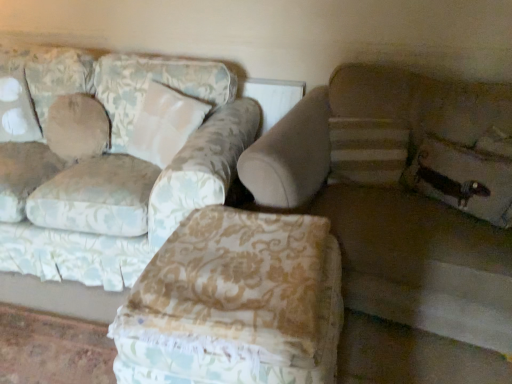
Identify the location of floral fabric pillow at lower right, which ranks as the first pillow in right-to-left order. The width and height of the screenshot is (512, 384). (464, 179).

What do you see at coordinates (234, 303) in the screenshot? The image size is (512, 384). I see `floral fabric ottoman at center` at bounding box center [234, 303].

How much space does beige fabric pillow at upper left, placed as the 2th pillow when sorted from front to back, occupy horizontally?

beige fabric pillow at upper left, placed as the 2th pillow when sorted from front to back, is 22.76 centimeters wide.

You are a GUI agent. You are given a task and a screenshot of the screen. Output one action in this format:
    pyautogui.click(x=<x>, y=<y>)
    Task: Click on the beige fabric couch at right, the second studio couch from the left
    This screenshot has width=512, height=384.
    Given the screenshot: What is the action you would take?
    pyautogui.click(x=402, y=194)

Can you see beige fabric couch at right, the first studio couch when ordered from right to left, touching floral fabric pillow at lower right, which ranks as the first pillow in right-to-left order?

No, beige fabric couch at right, the first studio couch when ordered from right to left, is not beside floral fabric pillow at lower right, which ranks as the first pillow in right-to-left order.

Would you say beige fabric couch at right, the first studio couch when ordered from right to left, is to the left or to the right of floral fabric pillow at lower right, the first pillow viewed from the front, in the picture?

In the image, beige fabric couch at right, the first studio couch when ordered from right to left, appears on the left side of floral fabric pillow at lower right, the first pillow viewed from the front.

From a real-world perspective, is beige fabric couch at right, the first studio couch when ordered from right to left, beneath floral fabric pillow at lower right, the first pillow viewed from the front?

Yes, from a real-world perspective, beige fabric couch at right, the first studio couch when ordered from right to left, is beneath floral fabric pillow at lower right, the first pillow viewed from the front.

How many degrees apart are the facing directions of beige fabric couch at right, the first studio couch when ordered from right to left, and floral fabric pillow at lower right, the 2th pillow viewed from the back?

The angle between the facing direction of beige fabric couch at right, the first studio couch when ordered from right to left, and the facing direction of floral fabric pillow at lower right, the 2th pillow viewed from the back, is 28 degrees.

Does point (202, 80) come closer to viewer compared to point (398, 144)?

No, it is behind (398, 144).

You are a GUI agent. You are given a task and a screenshot of the screen. Output one action in this format:
    pyautogui.click(x=<x>, y=<y>)
    Task: Click on the studio couch behind the beige fabric couch at right, the second studio couch from the left
    
    Given the screenshot: What is the action you would take?
    pyautogui.click(x=125, y=165)

Does floral fabric couch at left, the 2th studio couch in the right-to-left sequence, turn towards beige fabric couch at right, the second studio couch from the left?

No, floral fabric couch at left, the 2th studio couch in the right-to-left sequence, is not turned towards beige fabric couch at right, the second studio couch from the left.

Would you say floral fabric couch at left, the 2th studio couch in the right-to-left sequence, contains beige fabric couch at right, the first studio couch when ordered from right to left?

That's incorrect, beige fabric couch at right, the first studio couch when ordered from right to left, is not inside floral fabric couch at left, the 2th studio couch in the right-to-left sequence.

Is floral fabric ottoman at center wider than floral fabric pillow at lower right, the 2th pillow viewed from the back?

Yes, floral fabric ottoman at center is wider than floral fabric pillow at lower right, the 2th pillow viewed from the back.

Is floral fabric ottoman at center directly adjacent to floral fabric pillow at lower right, which ranks as the first pillow in right-to-left order?

No, floral fabric ottoman at center is not beside floral fabric pillow at lower right, which ranks as the first pillow in right-to-left order.

Is floral fabric ottoman at center located outside floral fabric pillow at lower right, the 2th pillow viewed from the back?

Indeed, floral fabric ottoman at center is completely outside floral fabric pillow at lower right, the 2th pillow viewed from the back.

Is beige fabric pillow at upper left, placed as the 2th pillow when sorted from front to back, to the left of floral fabric pillow at lower right, the 2th pillow viewed from the back, from the viewer's perspective?

Correct, you'll find beige fabric pillow at upper left, placed as the 2th pillow when sorted from front to back, to the left of floral fabric pillow at lower right, the 2th pillow viewed from the back.

Which object is closer to the camera, beige fabric pillow at upper left, the first pillow positioned from the back, or floral fabric pillow at lower right, which is counted as the 2th pillow, starting from the left?

floral fabric pillow at lower right, which is counted as the 2th pillow, starting from the left.

From a real-world perspective, is beige fabric pillow at upper left, arranged as the 2th pillow when viewed from the right, on top of floral fabric pillow at lower right, the 2th pillow viewed from the back?

Correct, in the physical world, beige fabric pillow at upper left, arranged as the 2th pillow when viewed from the right, is higher than floral fabric pillow at lower right, the 2th pillow viewed from the back.

In the scene shown: Is beige fabric pillow at upper left, arranged as the 2th pillow when viewed from the right, not inside floral fabric pillow at lower right, which ranks as the first pillow in right-to-left order?

Absolutely, beige fabric pillow at upper left, arranged as the 2th pillow when viewed from the right, is external to floral fabric pillow at lower right, which ranks as the first pillow in right-to-left order.

Which object is positioned more to the right, floral fabric couch at left, the 2th studio couch in the right-to-left sequence, or beige fabric pillow at upper left, the first pillow positioned from the back?

Positioned to the right is floral fabric couch at left, the 2th studio couch in the right-to-left sequence.

Considering the positions of objects floral fabric couch at left, which appears as the 1th studio couch when viewed from the left, and beige fabric pillow at upper left, placed as the 2th pillow when sorted from front to back, in the image provided, who is in front, floral fabric couch at left, which appears as the 1th studio couch when viewed from the left, or beige fabric pillow at upper left, placed as the 2th pillow when sorted from front to back,?

floral fabric couch at left, which appears as the 1th studio couch when viewed from the left, is in front.

Is floral fabric couch at left, the 2th studio couch in the right-to-left sequence, far away from beige fabric pillow at upper left, placed as the 2th pillow when sorted from front to back?

floral fabric couch at left, the 2th studio couch in the right-to-left sequence, is actually quite close to beige fabric pillow at upper left, placed as the 2th pillow when sorted from front to back.

Which is in front, point (256, 125) or point (64, 140)?

The point (64, 140) is closer.

Considering the relative sizes of beige fabric couch at right, the second studio couch from the left, and beige fabric pillow at upper left, the 1th pillow in the left-to-right sequence, in the image provided, is beige fabric couch at right, the second studio couch from the left, wider than beige fabric pillow at upper left, the 1th pillow in the left-to-right sequence,?

Yes, beige fabric couch at right, the second studio couch from the left, is wider than beige fabric pillow at upper left, the 1th pillow in the left-to-right sequence.

Can you tell me how much beige fabric couch at right, the second studio couch from the left, and beige fabric pillow at upper left, the 1th pillow in the left-to-right sequence, differ in facing direction?

16.7 degrees separate the facing orientations of beige fabric couch at right, the second studio couch from the left, and beige fabric pillow at upper left, the 1th pillow in the left-to-right sequence.

Does beige fabric couch at right, the first studio couch when ordered from right to left, lie behind beige fabric pillow at upper left, placed as the 2th pillow when sorted from front to back?

No.

Could you measure the distance between beige fabric couch at right, the second studio couch from the left, and beige fabric pillow at upper left, placed as the 2th pillow when sorted from front to back?

A distance of 4.26 feet exists between beige fabric couch at right, the second studio couch from the left, and beige fabric pillow at upper left, placed as the 2th pillow when sorted from front to back.

Measure the distance from floral fabric ottoman at center to beige fabric couch at right, the first studio couch when ordered from right to left.

floral fabric ottoman at center is 19.43 inches away from beige fabric couch at right, the first studio couch when ordered from right to left.

Is floral fabric ottoman at center next to beige fabric couch at right, the first studio couch when ordered from right to left, and touching it?

No, floral fabric ottoman at center is not in contact with beige fabric couch at right, the first studio couch when ordered from right to left.

Based on the photo, considering the positions of objects floral fabric ottoman at center and beige fabric couch at right, the second studio couch from the left, in the image provided, who is more to the right, floral fabric ottoman at center or beige fabric couch at right, the second studio couch from the left,?

beige fabric couch at right, the second studio couch from the left.

From a real-world perspective, which is physically below, floral fabric ottoman at center or beige fabric couch at right, the second studio couch from the left?

floral fabric ottoman at center, from a real-world perspective.

From the image's perspective, starting from the beige fabric couch at right, the first studio couch when ordered from right to left, which pillow is the 1st one above? Please provide its 2D coordinates.

[(464, 179)]

Where is `studio couch above the floral fabric couch at left, which appears as the 1th studio couch when viewed from the left (from a real-world perspective)`? This screenshot has width=512, height=384. studio couch above the floral fabric couch at left, which appears as the 1th studio couch when viewed from the left (from a real-world perspective) is located at coordinates (402, 194).

Based on their spatial positions, is beige fabric couch at right, the first studio couch when ordered from right to left, or floral fabric pillow at lower right, which ranks as the first pillow in right-to-left order, further from beige fabric pillow at upper left, the first pillow positioned from the back?

The object further to beige fabric pillow at upper left, the first pillow positioned from the back, is floral fabric pillow at lower right, which ranks as the first pillow in right-to-left order.

From the picture: Estimate the real-world distances between objects in this image. Which object is further from beige fabric couch at right, the second studio couch from the left, floral fabric pillow at lower right, the first pillow viewed from the front, or beige fabric pillow at upper left, the first pillow positioned from the back?

Among the two, beige fabric pillow at upper left, the first pillow positioned from the back, is located further to beige fabric couch at right, the second studio couch from the left.

Considering their positions, is floral fabric couch at left, which appears as the 1th studio couch when viewed from the left, positioned closer to beige fabric pillow at upper left, the first pillow positioned from the back, than beige fabric couch at right, the second studio couch from the left?

Based on the image, floral fabric couch at left, which appears as the 1th studio couch when viewed from the left, appears to be nearer to beige fabric pillow at upper left, the first pillow positioned from the back.

When comparing their distances from floral fabric couch at left, which appears as the 1th studio couch when viewed from the left, does floral fabric pillow at lower right, the 2th pillow viewed from the back, or floral fabric ottoman at center seem closer?

Among the two, floral fabric ottoman at center is located nearer to floral fabric couch at left, which appears as the 1th studio couch when viewed from the left.

Which object lies further to the anchor point beige fabric pillow at upper left, placed as the 2th pillow when sorted from front to back, floral fabric ottoman at center or floral fabric pillow at lower right, the 2th pillow viewed from the back?

floral fabric pillow at lower right, the 2th pillow viewed from the back, is positioned further to the anchor beige fabric pillow at upper left, placed as the 2th pillow when sorted from front to back.

When comparing their distances from beige fabric couch at right, the second studio couch from the left, does beige fabric pillow at upper left, arranged as the 2th pillow when viewed from the right, or floral fabric couch at left, the 2th studio couch in the right-to-left sequence, seem closer?

Among the two, floral fabric couch at left, the 2th studio couch in the right-to-left sequence, is located nearer to beige fabric couch at right, the second studio couch from the left.

Based on the photo, looking at the image, which one is located closer to floral fabric ottoman at center, beige fabric couch at right, the first studio couch when ordered from right to left, or floral fabric pillow at lower right, the 2th pillow viewed from the back?

beige fabric couch at right, the first studio couch when ordered from right to left.

Considering their positions, is floral fabric pillow at lower right, the first pillow viewed from the front, positioned closer to beige fabric couch at right, the first studio couch when ordered from right to left, than floral fabric ottoman at center?

Among the two, floral fabric pillow at lower right, the first pillow viewed from the front, is located nearer to beige fabric couch at right, the first studio couch when ordered from right to left.

I want to click on studio couch situated between floral fabric ottoman at center and floral fabric pillow at lower right, the first pillow viewed from the front, from left to right, so click(x=402, y=194).

Locate an element on the screen. This screenshot has height=384, width=512. swivel chair situated between beige fabric pillow at upper left, the 1th pillow in the left-to-right sequence, and beige fabric couch at right, the first studio couch when ordered from right to left, from left to right is located at coordinates (234, 303).

In order to click on swivel chair between beige fabric pillow at upper left, the 1th pillow in the left-to-right sequence, and floral fabric pillow at lower right, the 2th pillow viewed from the back, in the horizontal direction in this screenshot , I will do `click(234, 303)`.

The height and width of the screenshot is (384, 512). Find the location of `studio couch located between beige fabric pillow at upper left, arranged as the 2th pillow when viewed from the right, and beige fabric couch at right, the second studio couch from the left, in the left-right direction`. studio couch located between beige fabric pillow at upper left, arranged as the 2th pillow when viewed from the right, and beige fabric couch at right, the second studio couch from the left, in the left-right direction is located at coordinates (125, 165).